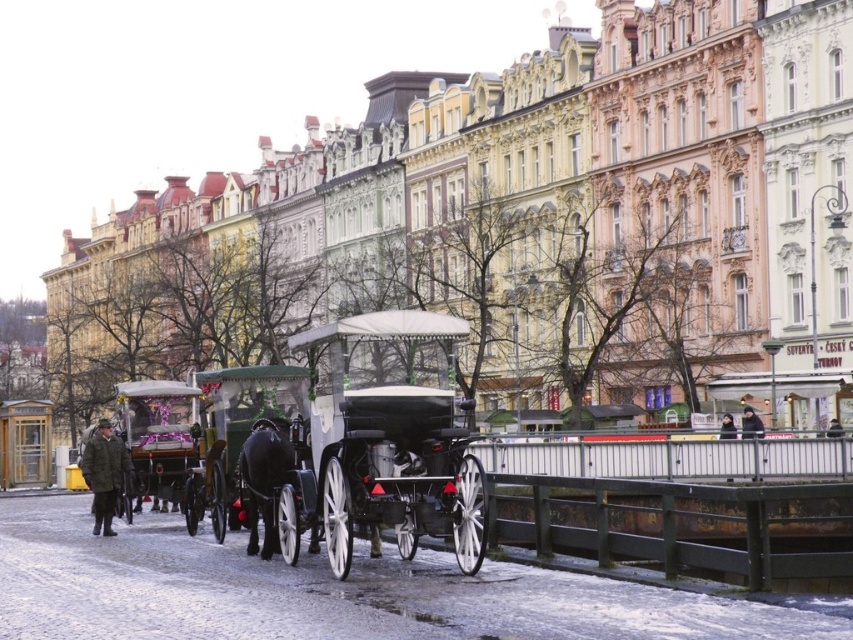
Between shiny black wagon at center and black glossy horse at center, which one has more height?

Standing taller between the two is shiny black wagon at center.

Based on the photo, can you confirm if shiny black wagon at center is wider than black glossy horse at center?

Yes, shiny black wagon at center is wider than black glossy horse at center.

Find the location of a particular element. shiny black wagon at center is located at coordinates (239, 433).

This screenshot has width=853, height=640. Identify the location of shiny black wagon at center. (239, 433).

Does black glossy horse at center have a larger size compared to dark brown leather jacket at center?

No.

Between black glossy horse at center and dark brown leather jacket at center, which one is positioned lower?

black glossy horse at center is lower down.

Identify the location of black glossy horse at center. (264, 481).

Where is `black glossy horse at center`? The image size is (853, 640). black glossy horse at center is located at coordinates (264, 481).

Between point (251, 460) and point (103, 484), which one is positioned in front?

Positioned in front is point (251, 460).

Who is positioned more to the right, black glossy horse at center or dark green wool coat at left?

black glossy horse at center is more to the right.

This screenshot has width=853, height=640. I want to click on black glossy horse at center, so click(264, 481).